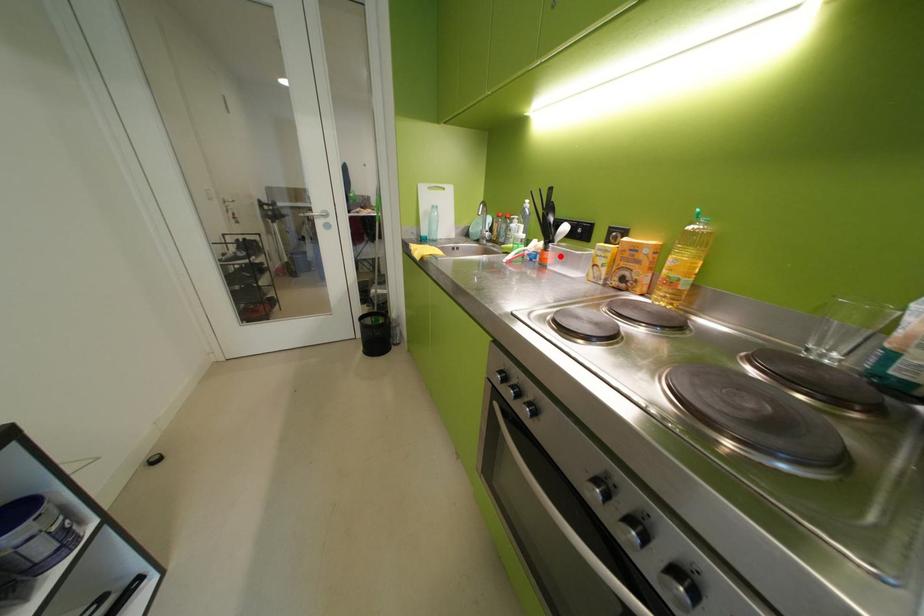
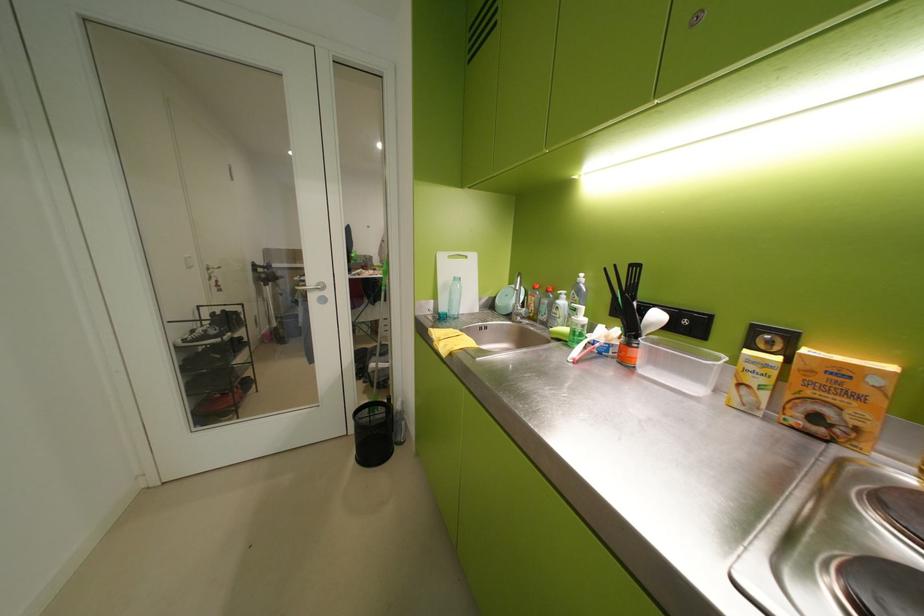
In the second image, find the point that corresponds to the highlighted location in the first image.

(650, 354)